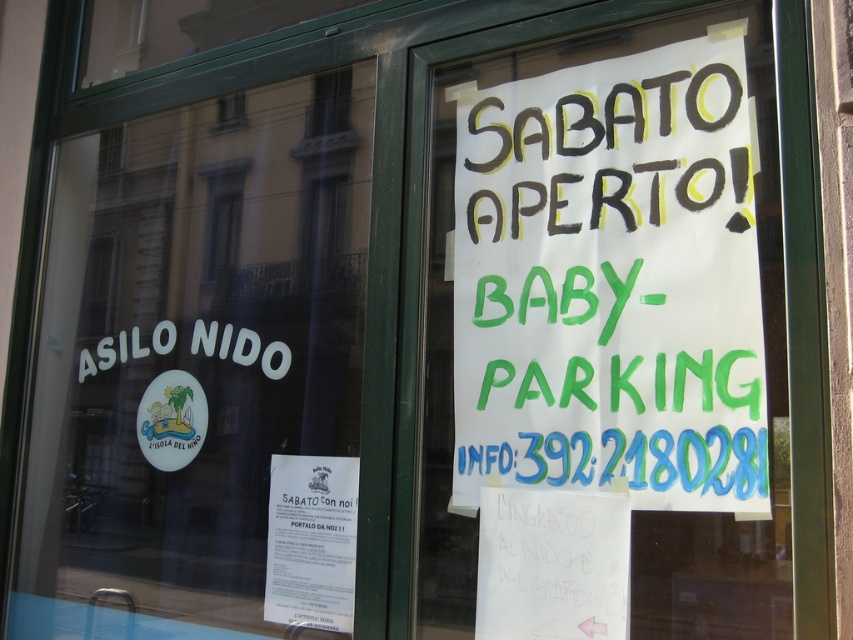
What is the relationship in size between the white paper sign at upper center and the smooth glass window at upper center?

The white paper sign at upper center is bigger than the smooth glass window at upper center.

What is the relationship between the white paper at upper left and the smooth glass window at upper center in terms of their positions?

The white paper at upper left is in front of the smooth glass window at upper center.

Looking at this image, you are standing 1.5 meters away from the glass door. You want to read the white paper sign at upper center. Can you reach it without moving closer?

The white paper sign at upper center is 1.02 meters from the camera. Since you are standing 1.5 meters away from the glass door, you are 0.48 meters farther than the required distance to reach the sign. Therefore, you need to move 0.48 meters closer to read it.